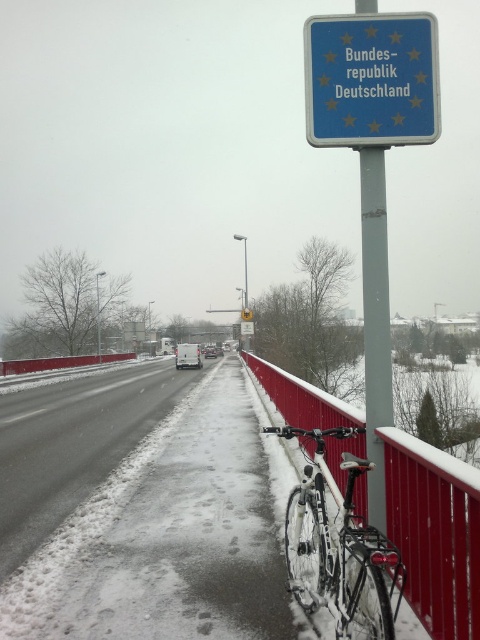
Does blue plastic sign at upper center have a lesser height compared to metallic pole at upper center?

Yes.

This screenshot has width=480, height=640. Describe the element at coordinates (372, 80) in the screenshot. I see `blue plastic sign at upper center` at that location.

This screenshot has width=480, height=640. I want to click on blue plastic sign at upper center, so click(x=372, y=80).

Looking at this image, between red metal fence at right and blue plastic sign at upper center, which one has less height?

red metal fence at right is shorter.

Does point (437, 636) come in front of point (358, 76)?

Yes, it is in front of point (358, 76).

Identify the location of red metal fence at right. This screenshot has height=640, width=480. (434, 532).

Does snowy asphalt highway at center have a lesser height compared to blue plastic sign at upper center?

Correct, snowy asphalt highway at center is not as tall as blue plastic sign at upper center.

Does snowy asphalt highway at center have a larger size compared to blue plastic sign at upper center?

Correct, snowy asphalt highway at center is larger in size than blue plastic sign at upper center.

Where is `snowy asphalt highway at center`? The image size is (480, 640). snowy asphalt highway at center is located at coordinates (72, 445).